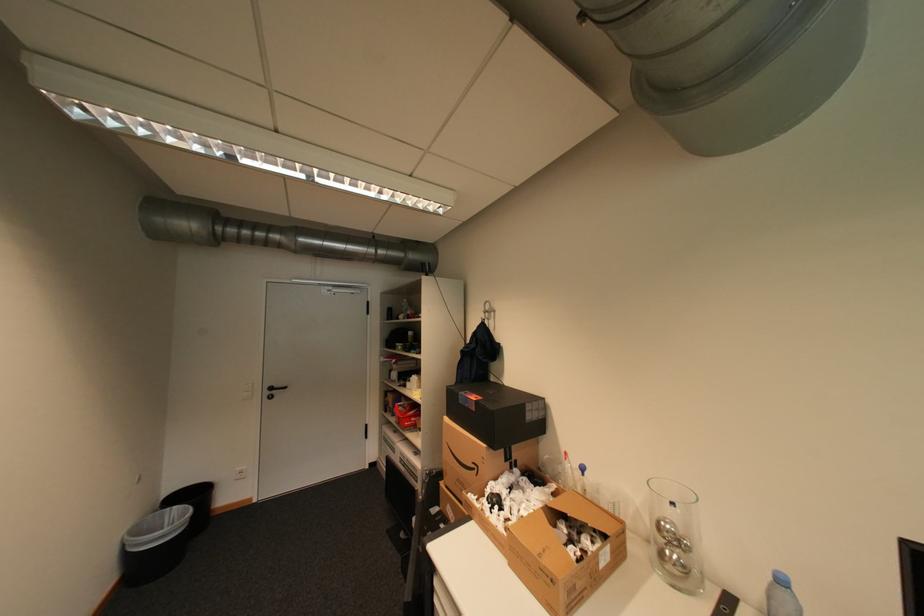
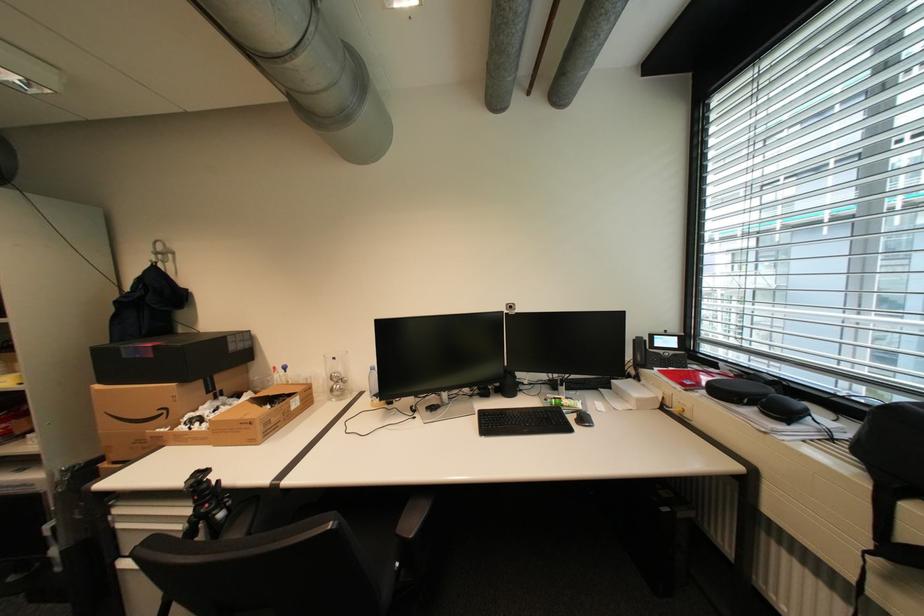
Where in the second image is the point corresponding to the point at 561,582 from the first image?

(259, 424)